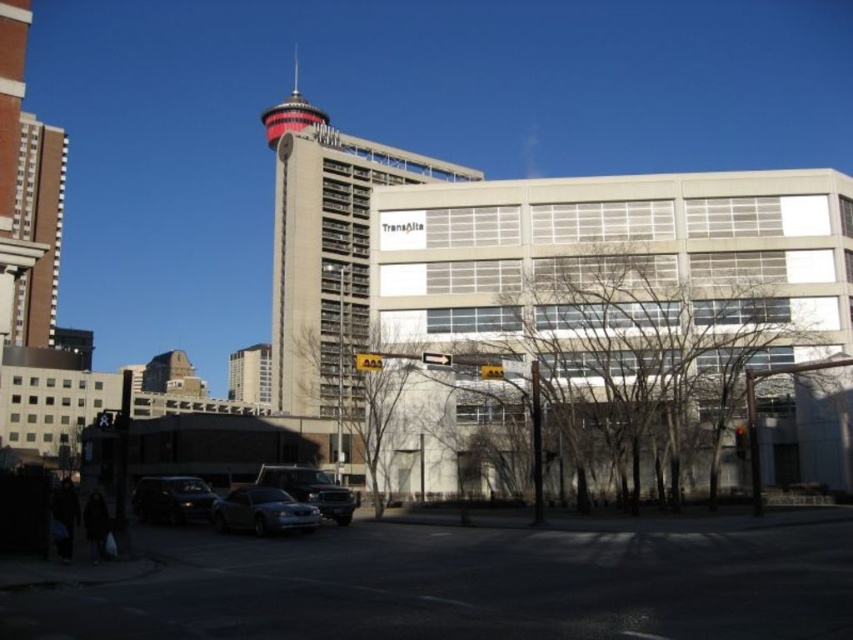
Question: Can you confirm if brown concrete building at left is positioned to the left of satin silver sedan at lower center?

Choices:
 (A) yes
 (B) no

Answer: (A)

Question: Which object is farther from the camera taking this photo?

Choices:
 (A) shiny silver sedan at center
 (B) red and white striped tower at upper center
 (C) brown concrete building at left

Answer: (B)

Question: Which point is farther to the camera?

Choices:
 (A) brown concrete building at left
 (B) satin silver sedan at lower center
 (C) red and white striped tower at upper center
 (D) shiny silver sedan at center

Answer: (C)

Question: Which point appears closest to the camera in this image?

Choices:
 (A) (196, 481)
 (B) (273, 500)

Answer: (B)

Question: Can you confirm if brown concrete building at left is wider than red and white striped tower at upper center?

Choices:
 (A) yes
 (B) no

Answer: (A)

Question: Where is shiny silver sedan at center located in relation to red and white striped tower at upper center in the image?

Choices:
 (A) left
 (B) right

Answer: (B)